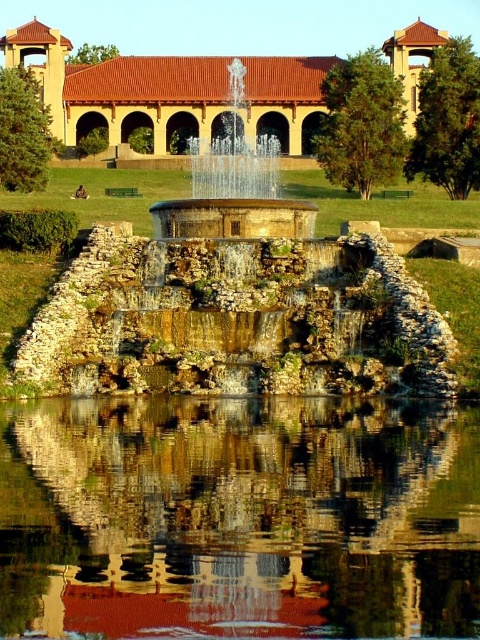
Can you confirm if smooth reflective water at center is positioned to the right of beige stone building at center?

In fact, smooth reflective water at center is to the left of beige stone building at center.

Does smooth reflective water at center have a lesser height compared to beige stone building at center?

Yes, smooth reflective water at center is shorter than beige stone building at center.

Is point (321, 588) farther from camera compared to point (386, 44)?

No, (321, 588) is in front of (386, 44).

Where is `smooth reflective water at center`? smooth reflective water at center is located at coordinates (239, 516).

Does point (189, 596) come farther from viewer compared to point (264, 176)?

That is False.

Can you confirm if smooth reflective water at center is shorter than shiny metallic fountain at center?

Yes, smooth reflective water at center is shorter than shiny metallic fountain at center.

Is point (181, 496) positioned before point (190, 234)?

Yes, it is.

The width and height of the screenshot is (480, 640). I want to click on smooth reflective water at center, so pyautogui.click(x=239, y=516).

Describe the element at coordinates (168, 92) in the screenshot. This screenshot has height=640, width=480. I see `beige stone building at center` at that location.

Is beige stone building at center thinner than shiny metallic fountain at center?

No.

Between point (259, 129) and point (195, 141), which one is positioned behind?

Positioned behind is point (259, 129).

What are the coordinates of `beige stone building at center` in the screenshot? It's located at (168, 92).